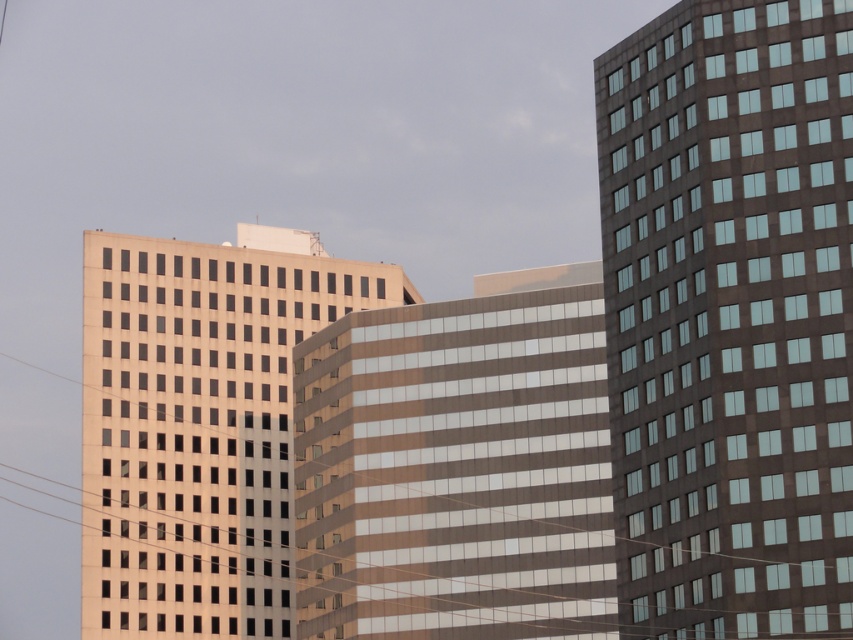
You are a delivery drone with a wingspan of 6 feet. You need to fly between the brown glass building at center and the matte glass building at center. Is there enough space for you to pass through?

The distance between the brown glass building at center and the matte glass building at center is 71.56 feet, which is more than enough for a drone with a 6 feet wingspan to pass through safely.

You are standing on the sidewalk in front of the cluster of modern high rise buildings. You want to take a photo of the brown glass building at center and matte glass building at center. Which one will appear larger in the photo?

The brown glass building at center will appear larger in the photo because it is in front of the matte glass building at center.